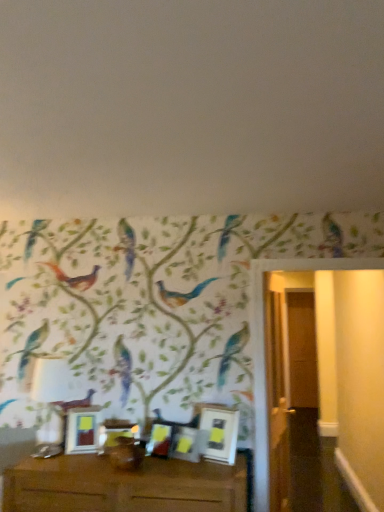
Question: Is matte white picture frame at center, which ranks as the 5th picture frame in right-to-left order, bigger than matte white picture frame at center, the second picture frame from the right?

Choices:
 (A) yes
 (B) no

Answer: (A)

Question: Considering the relative sizes of matte white picture frame at center, which ranks as the 5th picture frame in right-to-left order, and matte white picture frame at center, which appears as the 4th picture frame when viewed from the left, in the image provided, is matte white picture frame at center, which ranks as the 5th picture frame in right-to-left order, smaller than matte white picture frame at center, which appears as the 4th picture frame when viewed from the left,?

Choices:
 (A) yes
 (B) no

Answer: (B)

Question: Is matte white picture frame at center, the first picture frame from the left, aimed at matte white picture frame at center, which appears as the 4th picture frame when viewed from the left?

Choices:
 (A) yes
 (B) no

Answer: (B)

Question: From a real-world perspective, is matte white picture frame at center, the first picture frame from the left, over matte white picture frame at center, the second picture frame from the right?

Choices:
 (A) yes
 (B) no

Answer: (A)

Question: Is matte white picture frame at center, the first picture frame from the left, wider than matte white picture frame at center, the second picture frame from the right?

Choices:
 (A) no
 (B) yes

Answer: (B)

Question: Is point (196, 455) positioned closer to the camera than point (160, 437)?

Choices:
 (A) farther
 (B) closer

Answer: (B)

Question: Is matte white picture frame at center, which appears as the 4th picture frame when viewed from the left, wider or thinner than matte white picture frame at center, which is the 3th picture frame from right to left?

Choices:
 (A) wide
 (B) thin

Answer: (B)

Question: Would you say matte white picture frame at center, which appears as the 4th picture frame when viewed from the left, is to the left or to the right of matte white picture frame at center, which is the 3th picture frame from right to left, in the picture?

Choices:
 (A) left
 (B) right

Answer: (B)

Question: From a real-world perspective, is matte white picture frame at center, which appears as the 4th picture frame when viewed from the left, positioned above or below matte white picture frame at center, which is the 3th picture frame from right to left?

Choices:
 (A) below
 (B) above

Answer: (A)

Question: Which is correct: matte white picture frame at center, the first picture frame from the left, is inside matte gold picture frame at center, which is the 2th picture frame from left to right, or outside of it?

Choices:
 (A) outside
 (B) inside

Answer: (A)

Question: From the image's perspective, is matte white picture frame at center, the first picture frame from the left, positioned above or below matte gold picture frame at center, the 4th picture frame when ordered from right to left?

Choices:
 (A) below
 (B) above

Answer: (B)

Question: Considering their positions, is matte white picture frame at center, which ranks as the 5th picture frame in right-to-left order, located in front of or behind matte gold picture frame at center, which is the 2th picture frame from left to right?

Choices:
 (A) front
 (B) behind

Answer: (B)

Question: From their relative heights in the image, would you say matte white picture frame at center, which ranks as the 5th picture frame in right-to-left order, is taller or shorter than matte gold picture frame at center, which is the 2th picture frame from left to right?

Choices:
 (A) tall
 (B) short

Answer: (A)

Question: Choose the correct answer: Is matte white picture frame at center, which is the 3th picture frame from right to left, inside matte white picture frame at center, the first picture frame from the left, or outside it?

Choices:
 (A) inside
 (B) outside

Answer: (B)

Question: Would you say matte white picture frame at center, which is the 3th picture frame from right to left, is to the left or to the right of matte white picture frame at center, the first picture frame from the left, in the picture?

Choices:
 (A) right
 (B) left

Answer: (A)